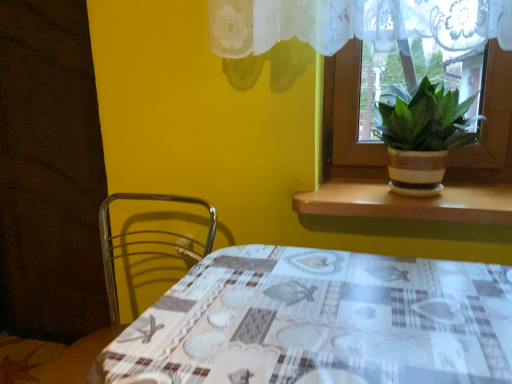
Question: Considering the relative sizes of brown wood at upper right and metallic wire chair at lower left in the image provided, is brown wood at upper right bigger than metallic wire chair at lower left?

Choices:
 (A) yes
 (B) no

Answer: (B)

Question: Can you confirm if brown wood at upper right is taller than metallic wire chair at lower left?

Choices:
 (A) no
 (B) yes

Answer: (A)

Question: Can you see brown wood at upper right touching metallic wire chair at lower left?

Choices:
 (A) no
 (B) yes

Answer: (A)

Question: From the image's perspective, would you say brown wood at upper right is positioned over metallic wire chair at lower left?

Choices:
 (A) no
 (B) yes

Answer: (B)

Question: From a real-world perspective, is brown wood at upper right beneath metallic wire chair at lower left?

Choices:
 (A) no
 (B) yes

Answer: (A)

Question: From a real-world perspective, is plaid fabric table at center positioned above or below brown wood at upper right?

Choices:
 (A) above
 (B) below

Answer: (B)

Question: From the image's perspective, is plaid fabric table at center positioned above or below brown wood at upper right?

Choices:
 (A) below
 (B) above

Answer: (A)

Question: Considering the positions of plaid fabric table at center and brown wood at upper right in the image, is plaid fabric table at center taller or shorter than brown wood at upper right?

Choices:
 (A) tall
 (B) short

Answer: (A)

Question: Visually, is plaid fabric table at center positioned to the left or to the right of brown wood at upper right?

Choices:
 (A) right
 (B) left

Answer: (B)

Question: From their relative heights in the image, would you say brown striped pot at window is taller or shorter than brown wood at upper right?

Choices:
 (A) tall
 (B) short

Answer: (A)

Question: From a real-world perspective, relative to brown wood at upper right, is brown striped pot at window vertically above or below?

Choices:
 (A) below
 (B) above

Answer: (B)

Question: Considering their positions, is brown striped pot at window located in front of or behind brown wood at upper right?

Choices:
 (A) front
 (B) behind

Answer: (A)

Question: In terms of size, does brown striped pot at window appear bigger or smaller than brown wood at upper right?

Choices:
 (A) big
 (B) small

Answer: (A)

Question: Considering the relative positions of brown wood at upper right and brown striped pot at window in the image provided, is brown wood at upper right to the left or to the right of brown striped pot at window?

Choices:
 (A) right
 (B) left

Answer: (B)

Question: Which is correct: brown wood at upper right is inside brown striped pot at window, or outside of it?

Choices:
 (A) inside
 (B) outside

Answer: (B)